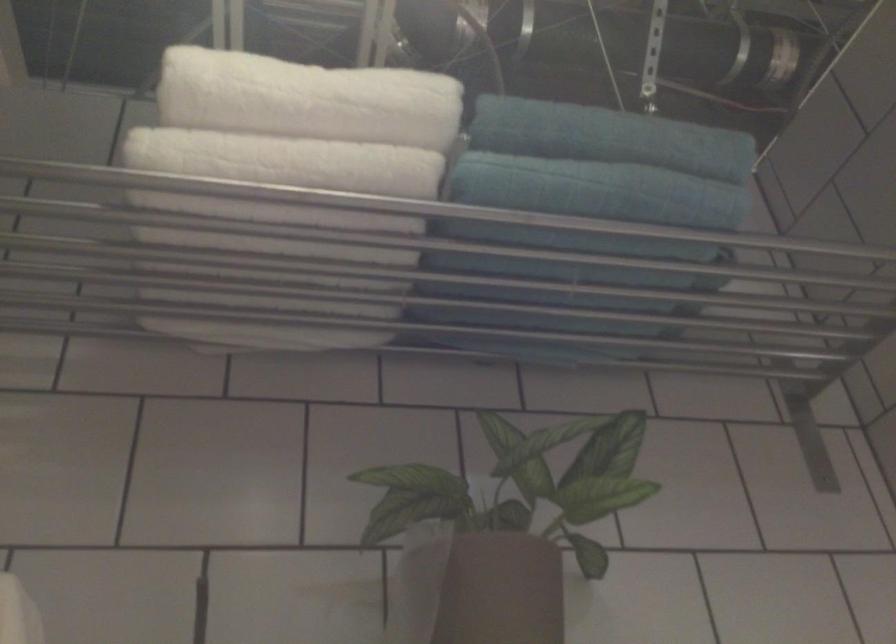
The location [501,591] corresponds to which object?

It refers to a brown plant pot.